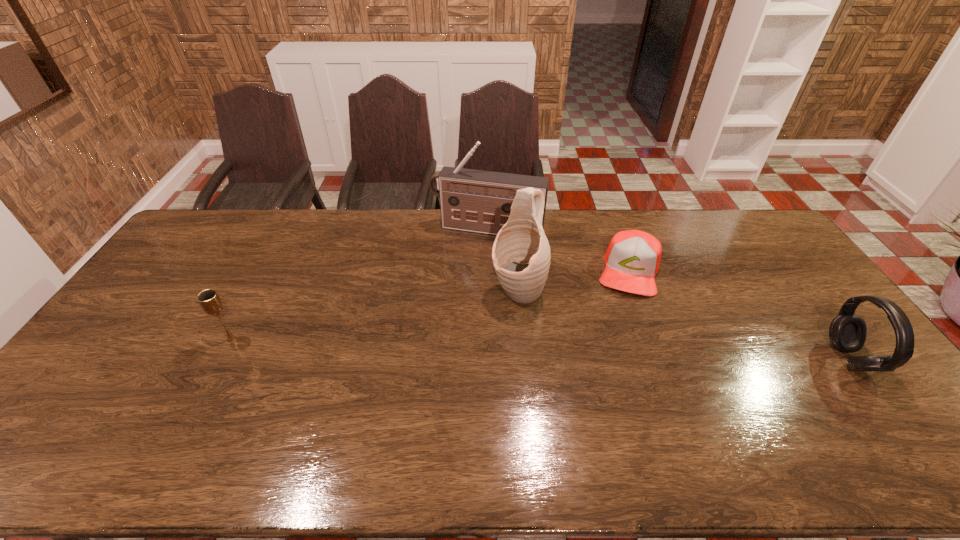
Where is `vacant space on the desktop that is between the chalice and the rightmost object and is positioned on the front-facing side of the fourth object from left to right`? vacant space on the desktop that is between the chalice and the rightmost object and is positioned on the front-facing side of the fourth object from left to right is located at coordinates (617, 351).

This screenshot has width=960, height=540. I want to click on vacant spot on the desktop that is between the leftmost object and the headset and is positioned at the spout of the pitcher, so click(479, 347).

The width and height of the screenshot is (960, 540). Find the location of `free space on the desktop that is between the leftmost object and the rightmost object and is positioned on the front panel of the radio receiver`. free space on the desktop that is between the leftmost object and the rightmost object and is positioned on the front panel of the radio receiver is located at coordinates (448, 346).